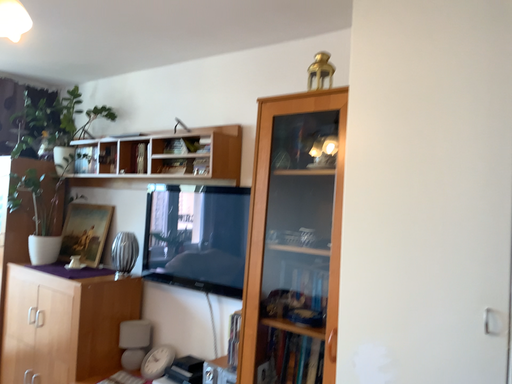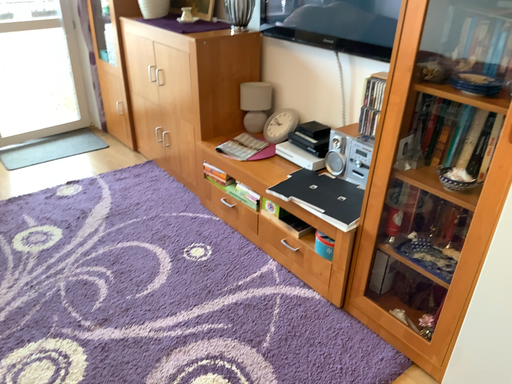
Question: Which way did the camera rotate in the video?

Choices:
 (A) rotated downward
 (B) rotated upward

Answer: (A)